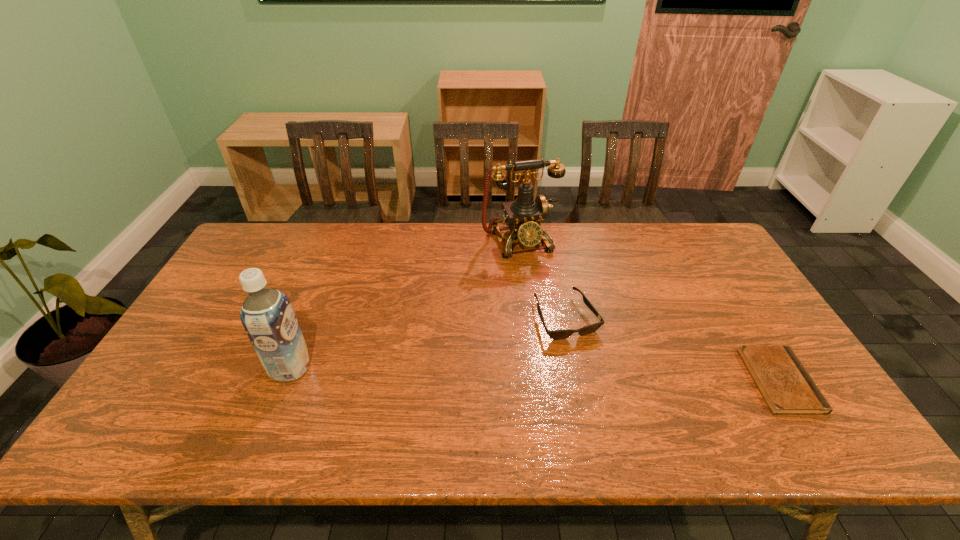
I want to click on vacant point located between the second shortest object and the diary, so click(x=673, y=349).

The height and width of the screenshot is (540, 960). In order to click on vacant area that lies between the second shortest object and the farthest object in this screenshot , I will do `click(543, 280)`.

At what (x,y) coordinates should I click in order to perform the action: click on vacant space that's between the second farthest object and the rightmost object. Please return your answer as a coordinate pair (x, y). The image size is (960, 540). Looking at the image, I should click on (673, 349).

Locate an element on the screen. This screenshot has width=960, height=540. unoccupied position between the sunglasses and the telephone is located at coordinates (543, 280).

This screenshot has width=960, height=540. I want to click on the third closest object to the farthest object, so click(x=267, y=316).

Identify which object is located as the third nearest to the diary. Please provide its 2D coordinates. Your answer should be formatted as a tuple, i.e. [(x, y)], where the tuple contains the x and y coordinates of a point satisfying the conditions above.

[(267, 316)]

Where is `free space in the image that satisfies the following two spatial constraints: 1. on the front side of the second farthest object; 2. on the spine side of the diary`? free space in the image that satisfies the following two spatial constraints: 1. on the front side of the second farthest object; 2. on the spine side of the diary is located at coordinates (579, 381).

Locate an element on the screen. Image resolution: width=960 pixels, height=540 pixels. free space in the image that satisfies the following two spatial constraints: 1. on the front side of the rightmost object; 2. on the spine side of the third nearest object is located at coordinates (579, 381).